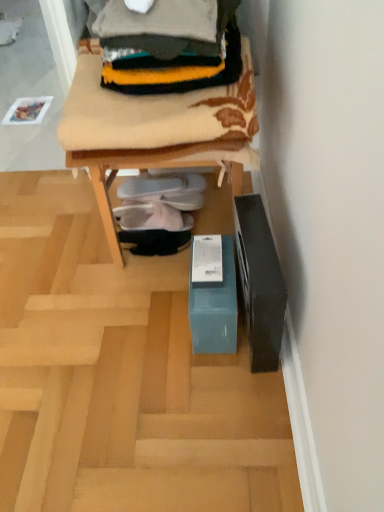
Question: Is knitted wool sweater at upper center inside the boundaries of teal cardboard box at lower center, or outside?

Choices:
 (A) outside
 (B) inside

Answer: (B)

Question: Is point (122, 9) closer or farther from the camera than point (148, 158)?

Choices:
 (A) closer
 (B) farther

Answer: (A)

Question: Based on their relative distances, which object is farther from the knitted wool sweater at upper center?

Choices:
 (A) teal cardboard box at lower center
 (B) teal cardboard box at lower center
 (C) black suede shoes at center, the first footwear ordered from the bottom
 (D) white fabric shoe at center, arranged as the second footwear when ordered from the bottom
 (E) white fabric slipper at center, which is the first footwear from top to bottom

Answer: (A)

Question: Estimate the real-world distances between objects in this image. Which object is farther from the knitted wool sweater at upper center?

Choices:
 (A) teal cardboard box at lower center
 (B) white fabric slipper at center, which is the third footwear in bottom-to-top order
 (C) teal cardboard box at lower center
 (D) black suede shoes at center, which is counted as the third footwear, starting from the top
 (E) white fabric shoe at center, the second footwear from the top

Answer: (C)